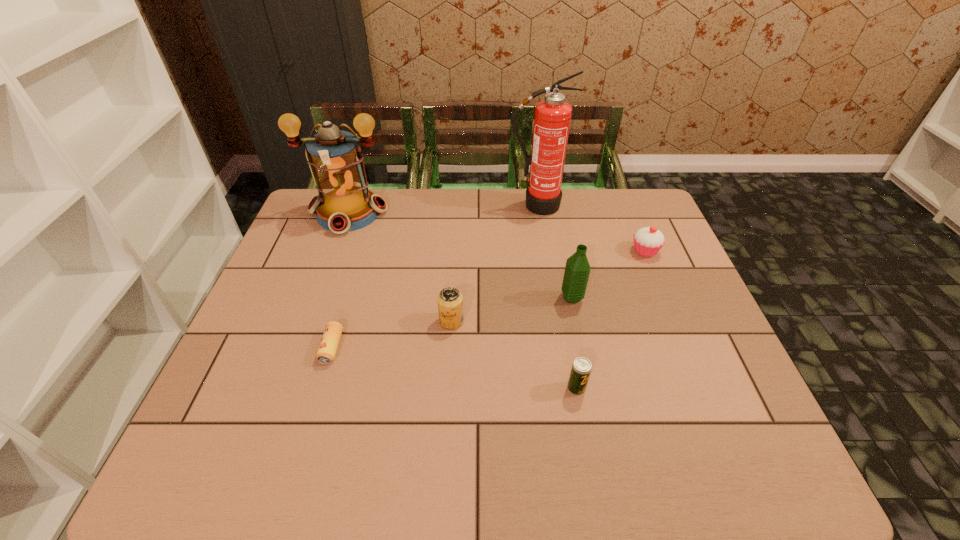
I want to click on fire extinguisher, so click(552, 118).

This screenshot has width=960, height=540. Find the location of `the second tallest object`. the second tallest object is located at coordinates (344, 203).

Locate an element on the screen. the fourth nearest object is located at coordinates (577, 271).

Image resolution: width=960 pixels, height=540 pixels. I want to click on the fifth shortest object, so click(x=577, y=271).

You are a GUI agent. You are given a task and a screenshot of the screen. Output one action in this format:
    pyautogui.click(x=<x>, y=<y>)
    Task: Click on the second beer can from left to right
    
    Given the screenshot: What is the action you would take?
    pyautogui.click(x=450, y=300)

Where is `the third object from left to right`? the third object from left to right is located at coordinates (450, 300).

Find the location of a particular element. This screenshot has height=540, width=960. cupcake is located at coordinates (648, 241).

Where is `the fifth nearest object`? the fifth nearest object is located at coordinates (648, 241).

You are a GUI agent. You are given a task and a screenshot of the screen. Output one action in this format:
    pyautogui.click(x=<x>, y=<y>)
    Task: Click on the nearest beer can
    The width and height of the screenshot is (960, 540).
    Given the screenshot: What is the action you would take?
    pyautogui.click(x=581, y=368)

This screenshot has width=960, height=540. Find the location of `the second shortest beer can`. the second shortest beer can is located at coordinates (581, 368).